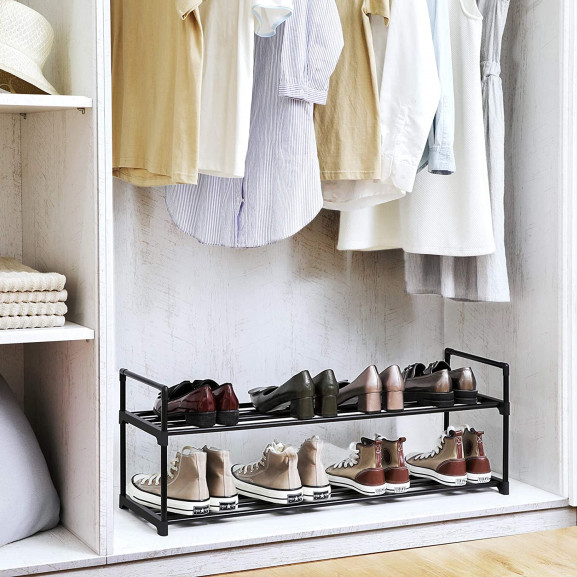
In order to click on linens in this screenshot , I will do `click(24, 277)`, `click(28, 295)`, `click(31, 306)`, `click(33, 322)`, `click(14, 464)`.